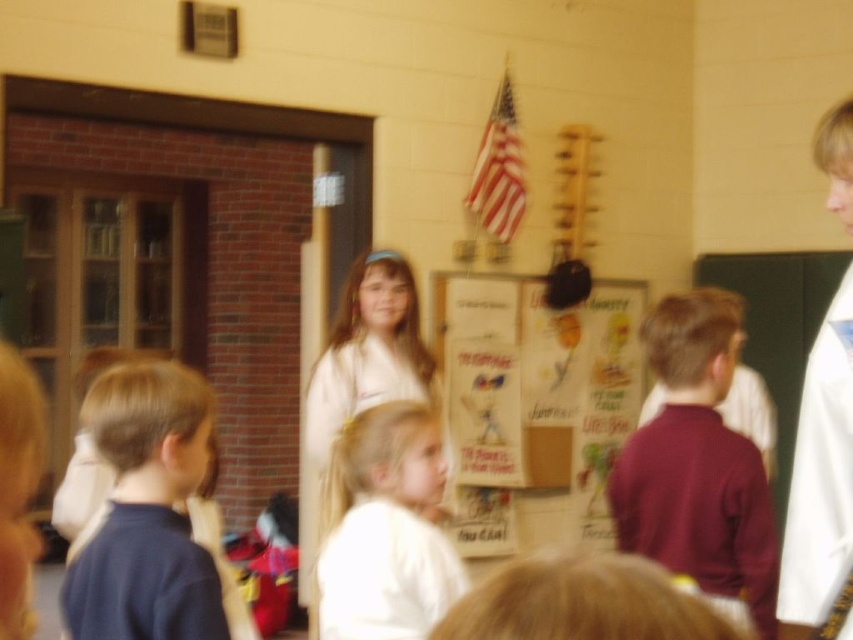
Question: Which point is closer to the camera?

Choices:
 (A) dark blue shirt at lower left
 (B) cardboard poster at center

Answer: (A)

Question: Is dark blue shirt at lower left smaller than white cotton dress at center?

Choices:
 (A) yes
 (B) no

Answer: (A)

Question: Among these points, which one is farthest from the camera?

Choices:
 (A) (364, 552)
 (B) (549, 476)

Answer: (B)

Question: Can you confirm if dark blue shirt at lower left is positioned to the right of white fabric dress at center?

Choices:
 (A) yes
 (B) no

Answer: (B)

Question: Does white cloth at upper right lie in front of white cotton dress at center?

Choices:
 (A) no
 (B) yes

Answer: (B)

Question: Which object is the closest to the cardboard poster at center?

Choices:
 (A) maroon sweater at center
 (B) white cloth at upper right
 (C) white cotton dress at center
 (D) white fabric dress at center

Answer: (C)